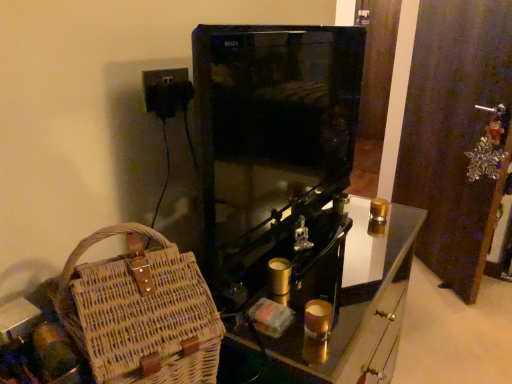
Question: Is metallic brown door at right surrounding woven wood basket at lower left?

Choices:
 (A) no
 (B) yes

Answer: (A)

Question: Does metallic brown door at right have a larger size compared to woven wood basket at lower left?

Choices:
 (A) no
 (B) yes

Answer: (A)

Question: From a real-world perspective, is metallic brown door at right located higher than woven wood basket at lower left?

Choices:
 (A) no
 (B) yes

Answer: (B)

Question: Considering the relative sizes of metallic brown door at right and woven wood basket at lower left in the image provided, is metallic brown door at right smaller than woven wood basket at lower left?

Choices:
 (A) yes
 (B) no

Answer: (A)

Question: Is metallic brown door at right outside of woven wood basket at lower left?

Choices:
 (A) no
 (B) yes

Answer: (B)

Question: Is point (368, 251) positioned closer to the camera than point (200, 301)?

Choices:
 (A) farther
 (B) closer

Answer: (A)

Question: In terms of size, does woven wood basket at lower left appear bigger or smaller than woven straw bag at lower left?

Choices:
 (A) small
 (B) big

Answer: (B)

Question: Visually, is woven wood basket at lower left positioned to the left or to the right of woven straw bag at lower left?

Choices:
 (A) right
 (B) left

Answer: (A)

Question: Do you think woven wood basket at lower left is within woven straw bag at lower left, or outside of it?

Choices:
 (A) inside
 (B) outside

Answer: (B)

Question: Is metallic brown door at right inside or outside of woven wood basket at lower left?

Choices:
 (A) inside
 (B) outside

Answer: (B)

Question: Looking at the image, does metallic brown door at right seem bigger or smaller compared to woven wood basket at lower left?

Choices:
 (A) big
 (B) small

Answer: (B)

Question: From the image's perspective, relative to woven wood basket at lower left, is metallic brown door at right above or below?

Choices:
 (A) below
 (B) above

Answer: (B)

Question: Is point (412, 178) positioned closer to the camera than point (289, 301)?

Choices:
 (A) closer
 (B) farther

Answer: (B)

Question: Is woven wood basket at lower left inside the boundaries of metallic brown door at right, or outside?

Choices:
 (A) outside
 (B) inside

Answer: (A)

Question: From the image's perspective, relative to metallic brown door at right, is woven wood basket at lower left above or below?

Choices:
 (A) below
 (B) above

Answer: (A)